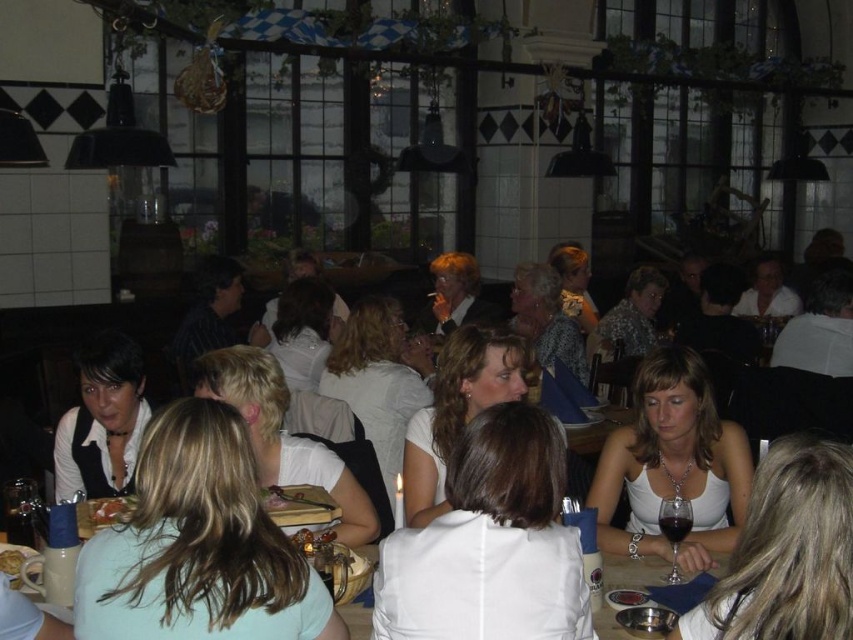
You are standing in the restaurant and want to reach a specific point marked at coordinates point (579, 570). If you are currently 1.5 meters away from that point, how much further do you need to move forward to reach it?

The distance of point (579, 570) from viewer is 2.07 meters. Since you are currently 1.5 meters away, you need to move an additional 0.57 meters to reach it.

You are a waiter in the restaurant and need to deliver a plate of food to the table. The golden brown bread at lower left is on the table. There is a matte black vest at left blocking your path. Can you reach the bread without moving the vest?

The matte black vest at left is positioned over golden brown bread at lower left, so the vest is covering the bread. Therefore, you cannot reach the bread without moving the vest.

You are a waiter in a busy restaurant and need to place a new order of golden brown bread at lower left on the white fabric table at center. Can you easily reach the table from where the bread is currently located?

The white fabric table at center is closer to the viewer than golden brown bread at lower left, meaning the bread is further away. Since the bread is further away, you would need to walk towards the table to place it there, so it is possible but may require some movement.